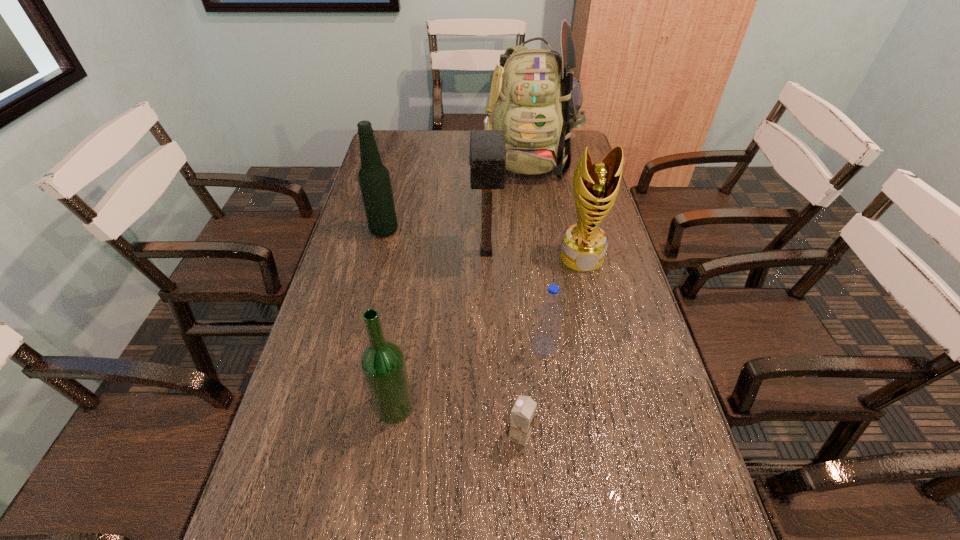
Where is `free space between the award and the shorter alcohol`? The height and width of the screenshot is (540, 960). free space between the award and the shorter alcohol is located at coordinates (488, 332).

You are a GUI agent. You are given a task and a screenshot of the screen. Output one action in this format:
    pyautogui.click(x=<x>, y=<y>)
    Task: Click on the third closest object to the farthest object
    
    Given the screenshot: What is the action you would take?
    pyautogui.click(x=374, y=179)

Point out which object is positioned as the third nearest to the mallet. Please provide its 2D coordinates. Your answer should be formatted as a tuple, i.e. [(x, y)], where the tuple contains the x and y coordinates of a point satisfying the conditions above.

[(547, 326)]